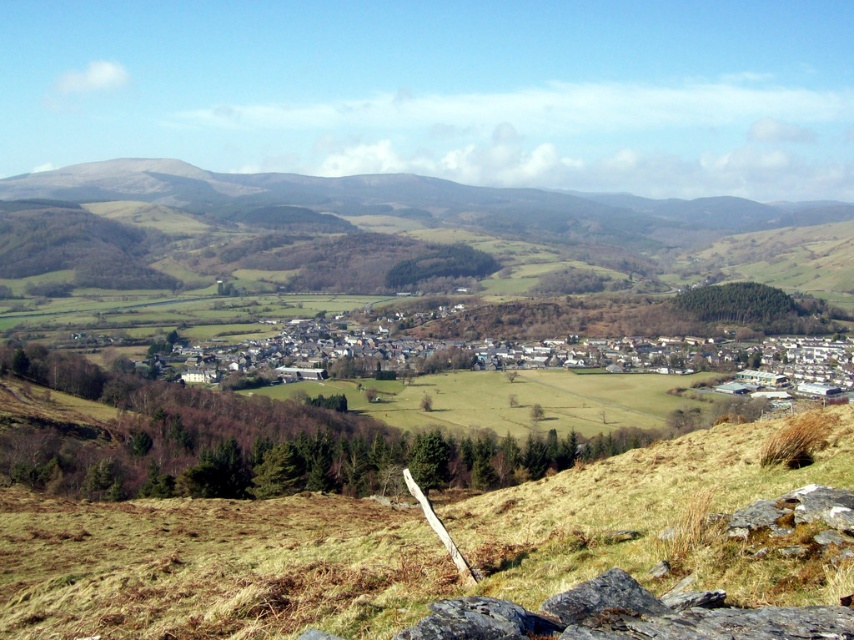
Does brown dry grass at lower center have a greater height compared to dark gray rough rock at lower center?

Correct, brown dry grass at lower center is much taller as dark gray rough rock at lower center.

Does brown dry grass at lower center have a larger size compared to dark gray rough rock at lower center?

Yes.

Between point (728, 454) and point (521, 608), which one is positioned behind?

Positioned behind is point (728, 454).

Identify the location of brown dry grass at lower center. (405, 547).

Does brown dry grass at lower center have a smaller size compared to green grassy hill at upper center?

Yes, brown dry grass at lower center is smaller than green grassy hill at upper center.

Who is higher up, brown dry grass at lower center or green grassy hill at upper center?

green grassy hill at upper center is above.

Does point (313, 593) come in front of point (733, 230)?

Yes.

This screenshot has width=854, height=640. I want to click on brown dry grass at lower center, so click(405, 547).

Can you confirm if green grassy hill at upper center is smaller than dark gray rock at lower right?

Incorrect, green grassy hill at upper center is not smaller in size than dark gray rock at lower right.

Can you confirm if green grassy hill at upper center is wider than dark gray rock at lower right?

Indeed, green grassy hill at upper center has a greater width compared to dark gray rock at lower right.

This screenshot has width=854, height=640. Identify the location of green grassy hill at upper center. (398, 234).